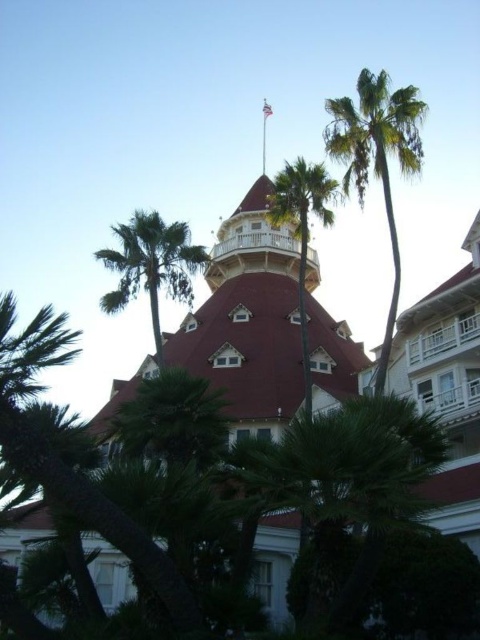
You are standing at the base of the green leafy palm tree at upper center and want to throw a frisbee to your friend who is 60 meters away from you. Is your friend within the throwing distance?

The green leafy palm tree at upper center and viewer are 61.61 meters apart from each other. Since your friend is 60 meters away from you, they are within the throwing distance.

From the picture: You are standing in front of the building and notice a point marked at coordinates [376,160]. Based on the scene description, what object does this point correspond to?

The point at coordinates [376,160] corresponds to the green leafy palm tree at right.